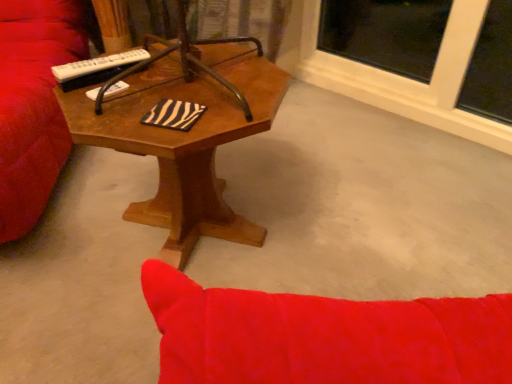
Question: Is wooden coffee table at center spatially inside white plastic remote at upper left, or outside of it?

Choices:
 (A) outside
 (B) inside

Answer: (A)

Question: Is point (133, 147) closer or farther from the camera than point (73, 74)?

Choices:
 (A) farther
 (B) closer

Answer: (B)

Question: From the image's perspective, relative to white plastic remote at upper left, is wooden coffee table at center above or below?

Choices:
 (A) below
 (B) above

Answer: (A)

Question: Is white plastic remote at upper left to the left or to the right of wooden coffee table at center in the image?

Choices:
 (A) right
 (B) left

Answer: (B)

Question: Considering the positions of white plastic remote at upper left and wooden coffee table at center in the image, is white plastic remote at upper left taller or shorter than wooden coffee table at center?

Choices:
 (A) tall
 (B) short

Answer: (B)

Question: From the image's perspective, is white plastic remote at upper left positioned above or below wooden coffee table at center?

Choices:
 (A) above
 (B) below

Answer: (A)

Question: From a real-world perspective, is white plastic remote at upper left positioned above or below wooden coffee table at center?

Choices:
 (A) below
 (B) above

Answer: (B)